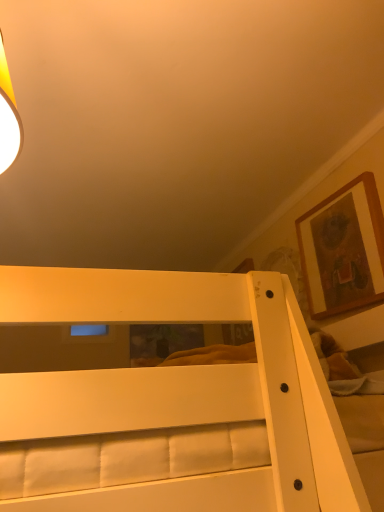
Find the location of `wooden framed artwork at upper right`. wooden framed artwork at upper right is located at coordinates (343, 249).

Describe the element at coordinates (343, 249) in the screenshot. I see `wooden framed artwork at upper right` at that location.

At what (x,y) coordinates should I click in order to perform the action: click on wooden framed artwork at upper right. Please return your answer as a coordinate pair (x, y). This screenshot has height=512, width=384. Looking at the image, I should click on (343, 249).